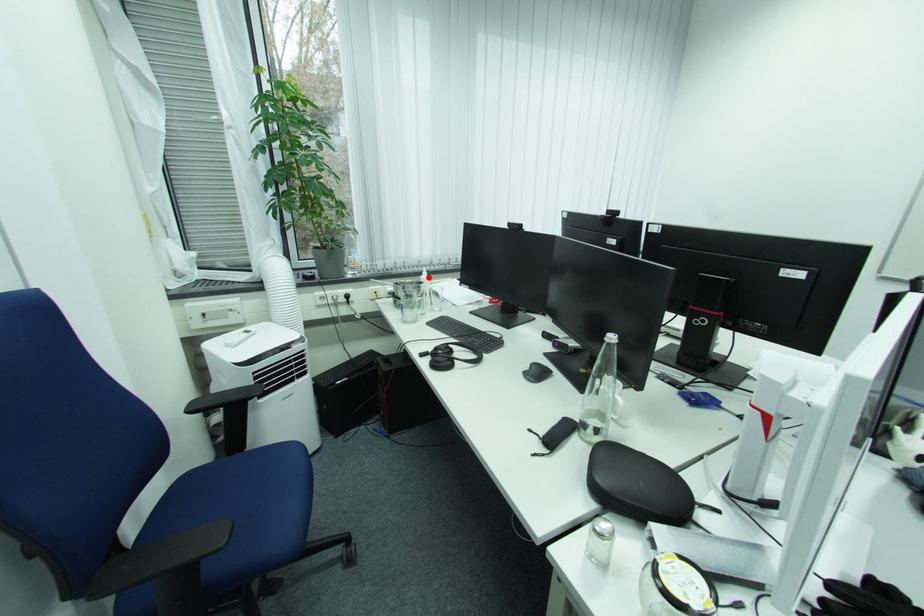
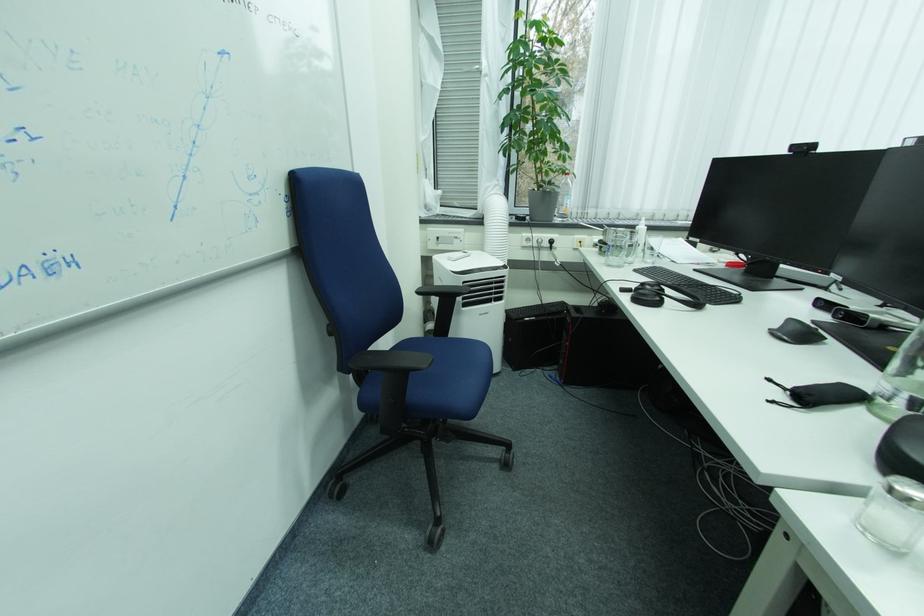
Locate, in the second image, the point that corresponds to the highlighted location in the first image.

(643, 227)